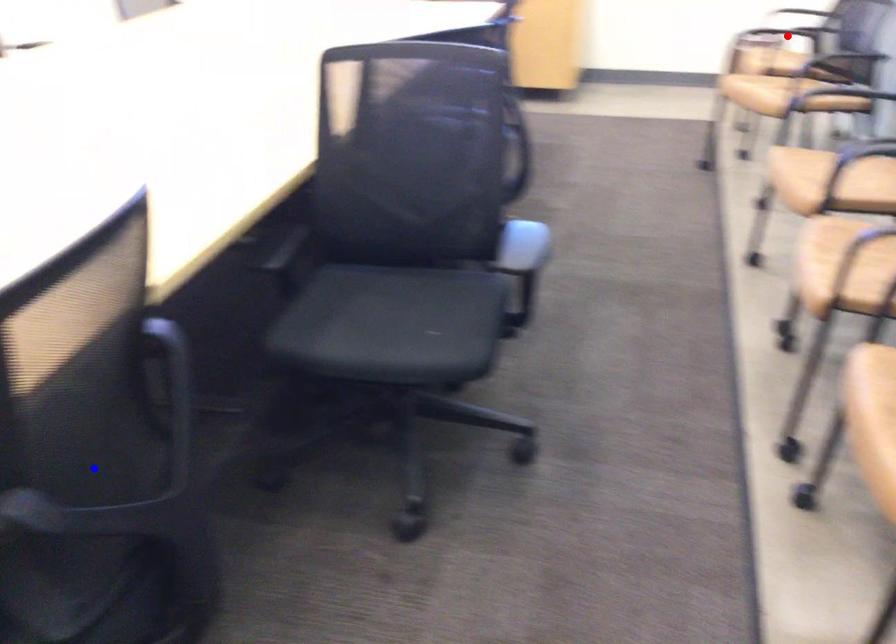
Question: Which of the two points in the image is closer to the camera?

Choices:
 (A) Blue point is closer.
 (B) Red point is closer.

Answer: (A)